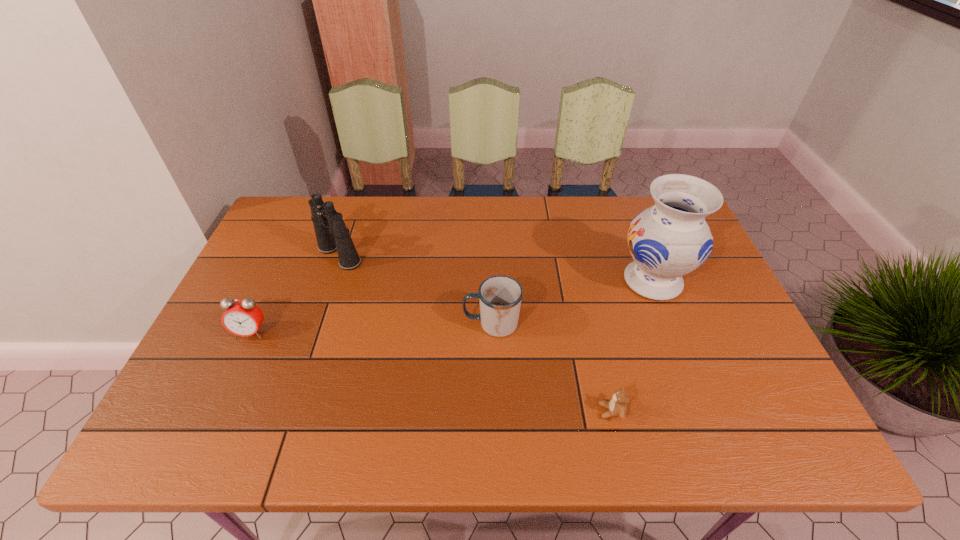
I want to click on object positioned at the right edge, so click(x=670, y=239).

Identify the location of vacant position at the far edge of the desktop. The width and height of the screenshot is (960, 540). (522, 215).

You are a GUI agent. You are given a task and a screenshot of the screen. Output one action in this format:
    pyautogui.click(x=<x>, y=<y>)
    Task: Click on the free space at the near edge of the desktop
    
    Given the screenshot: What is the action you would take?
    pyautogui.click(x=361, y=419)

Find the location of a particular element. The width and height of the screenshot is (960, 540). vacant region at the left edge of the desktop is located at coordinates (174, 407).

Find the location of a particular element. vacant space at the right edge of the desktop is located at coordinates (694, 278).

Identify the location of free space that is in between the teddy bear and the second tallest object. The height and width of the screenshot is (540, 960). (475, 333).

Identify the location of free space between the alarm clock and the fourth shortest object. The image size is (960, 540). point(296,294).

At what (x,y) coordinates should I click in order to perform the action: click on vacant space that's between the second tallest object and the tallest object. Please return your answer as a coordinate pair (x, y). This screenshot has width=960, height=540. Looking at the image, I should click on (496, 268).

Locate an element on the screen. vacant region between the vase and the alarm clock is located at coordinates (452, 307).

In order to click on vacant space in between the binoculars and the rightmost object in this screenshot , I will do `click(496, 268)`.